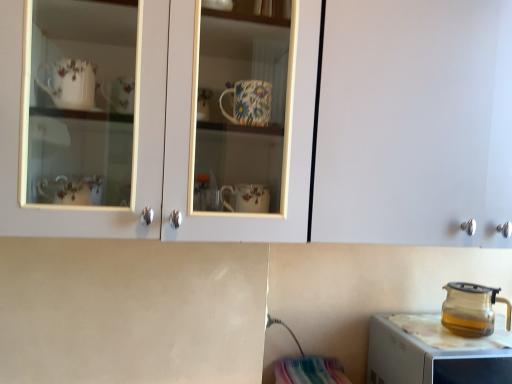
Question: Can you confirm if transparent glass teapot at right is positioned to the right of transparent glass kettle at lower right?

Choices:
 (A) no
 (B) yes

Answer: (A)

Question: From a real-world perspective, is transparent glass teapot at right located higher than transparent glass kettle at lower right?

Choices:
 (A) no
 (B) yes

Answer: (B)

Question: Can you confirm if transparent glass teapot at right is positioned to the left of transparent glass kettle at lower right?

Choices:
 (A) yes
 (B) no

Answer: (A)

Question: From a real-world perspective, is transparent glass teapot at right beneath transparent glass kettle at lower right?

Choices:
 (A) yes
 (B) no

Answer: (B)

Question: Does transparent glass teapot at right have a lesser height compared to transparent glass kettle at lower right?

Choices:
 (A) yes
 (B) no

Answer: (A)

Question: Which is correct: matte white cabinet at upper center is inside transparent glass teapot at right, or outside of it?

Choices:
 (A) outside
 (B) inside

Answer: (A)

Question: From the image's perspective, is matte white cabinet at upper center positioned above or below transparent glass teapot at right?

Choices:
 (A) below
 (B) above

Answer: (B)

Question: Based on their positions, is matte white cabinet at upper center located to the left or right of transparent glass teapot at right?

Choices:
 (A) right
 (B) left

Answer: (B)

Question: Does point (480, 62) appear closer or farther from the camera than point (470, 312)?

Choices:
 (A) farther
 (B) closer

Answer: (B)

Question: From a real-world perspective, is matte white cabinet at upper center positioned above or below transparent glass kettle at lower right?

Choices:
 (A) above
 (B) below

Answer: (A)

Question: In terms of height, does matte white cabinet at upper center look taller or shorter compared to transparent glass kettle at lower right?

Choices:
 (A) tall
 (B) short

Answer: (A)

Question: Looking at their shapes, would you say matte white cabinet at upper center is wider or thinner than transparent glass kettle at lower right?

Choices:
 (A) wide
 (B) thin

Answer: (B)

Question: Is matte white cabinet at upper center bigger or smaller than transparent glass kettle at lower right?

Choices:
 (A) small
 (B) big

Answer: (B)

Question: From a real-world perspective, is transparent glass kettle at lower right positioned above or below matte white cabinet at upper center?

Choices:
 (A) above
 (B) below

Answer: (B)

Question: Is transparent glass kettle at lower right taller or shorter than matte white cabinet at upper center?

Choices:
 (A) short
 (B) tall

Answer: (A)